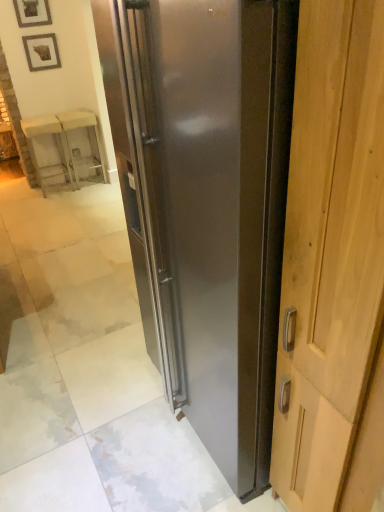
Question: Visually, is translucent glass cabinet at upper left, the 2th furniture viewed from the left, positioned to the left or to the right of stainless steel refrigerator at center?

Choices:
 (A) left
 (B) right

Answer: (A)

Question: Considering the positions of translucent glass cabinet at upper left, the 2th furniture viewed from the left, and stainless steel refrigerator at center in the image, is translucent glass cabinet at upper left, the 2th furniture viewed from the left, bigger or smaller than stainless steel refrigerator at center?

Choices:
 (A) big
 (B) small

Answer: (B)

Question: Which object is positioned closest to the wooden framed picture at upper left, which appears as the first picture frame when viewed from the top?

Choices:
 (A) stainless steel refrigerator at center
 (B) wooden picture frame at upper left, positioned as the 2th picture frame in top-to-bottom order
 (C) translucent glass cabinet at upper left, the 2th furniture viewed from the left
 (D) wooden chair at left, the second furniture viewed from the right

Answer: (B)

Question: Which of these objects is positioned farthest from the wooden framed picture at upper left, which appears as the first picture frame when viewed from the top?

Choices:
 (A) translucent glass cabinet at upper left, the 2th furniture viewed from the left
 (B) wooden chair at left, which is the 1th furniture from left to right
 (C) wooden picture frame at upper left, positioned as the 2th picture frame in top-to-bottom order
 (D) stainless steel refrigerator at center

Answer: (D)